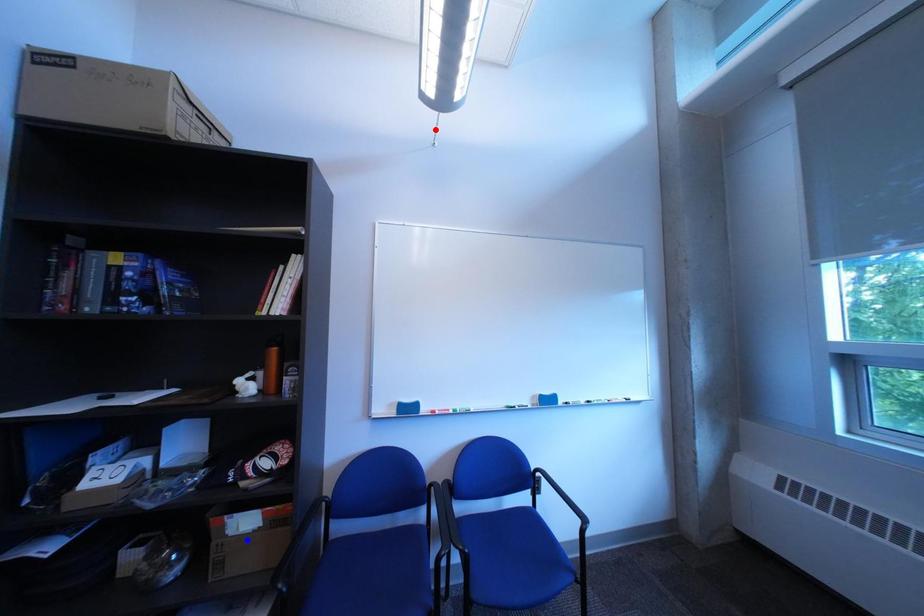
Question: Which of the two points in the image is closer to the camera?

Choices:
 (A) Blue point is closer.
 (B) Red point is closer.

Answer: (A)